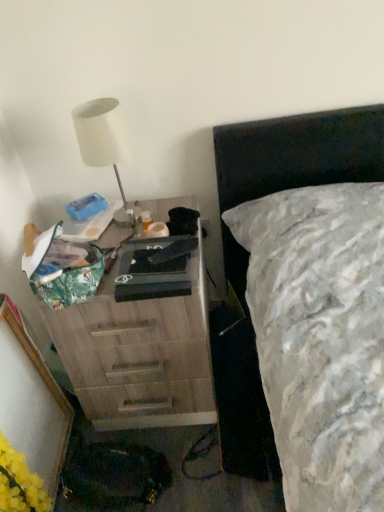
I want to click on vacant space to the right of white matte lamp at upper left, so click(x=159, y=210).